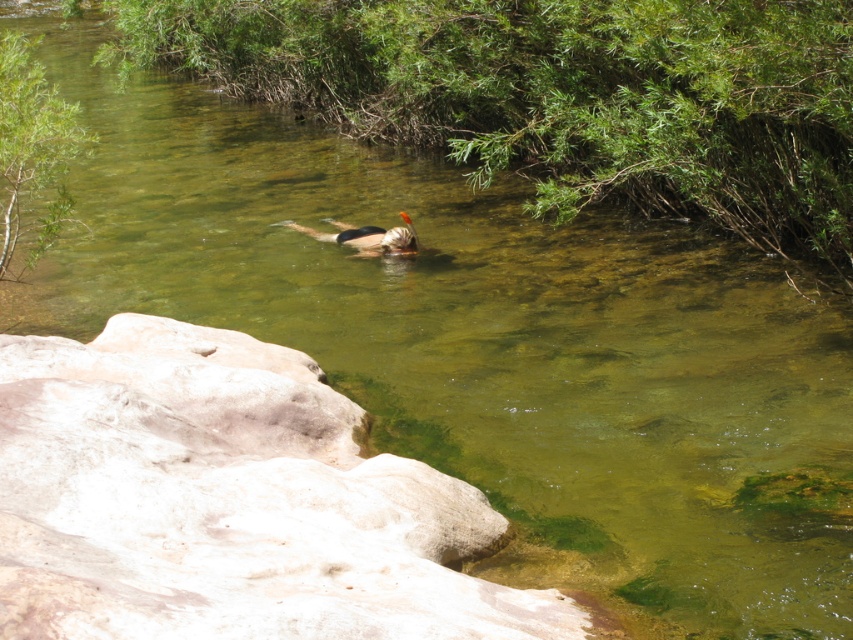
Between point (709, 72) and point (3, 257), which one is positioned behind?

Point (3, 257)

Find the location of `green leafy bush at upper center`. green leafy bush at upper center is located at coordinates (560, 93).

Is point (16, 212) positioned behind point (369, 234)?

No, it is not.

Which is behind, point (73, 108) or point (317, 240)?

The point (317, 240) is more distant.

This screenshot has width=853, height=640. I want to click on green leafy bush at upper left, so click(32, 150).

Does white rock at lower left have a greater height compared to smooth brown man at center?

Indeed, white rock at lower left has a greater height compared to smooth brown man at center.

Find the location of a particular element. This screenshot has height=640, width=853. white rock at lower left is located at coordinates (225, 500).

At what (x,y) coordinates should I click in order to perform the action: click on white rock at lower left. Please return your answer as a coordinate pair (x, y). The width and height of the screenshot is (853, 640). Looking at the image, I should click on (225, 500).

Locate an element on the screen. white rock at lower left is located at coordinates (225, 500).